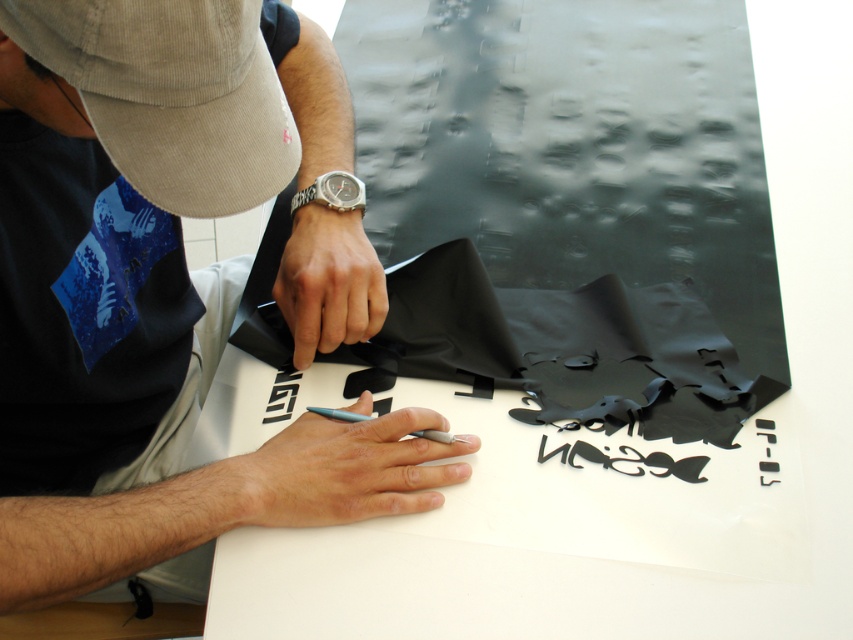
You are an art student observing the scene. You notice the matte black paper at center and the black paper cutout at center. Which object is positioned in front of the other?

The matte black paper at center is closer to the viewer than the black paper cutout at center, so it is positioned in front of the black paper cutout at center.

You are an art student who wants to create a similar piece. The instructions say that the distance between the matte black paper at center and the black paper cutout at center must be exactly 8 inches. Based on the image, will your artwork meet the requirement?

The distance between the matte black paper at center and the black paper cutout at center is 8.45 inches, which is 0.45 inches longer than the required 8 inches. Therefore, the artwork does not meet the requirement.